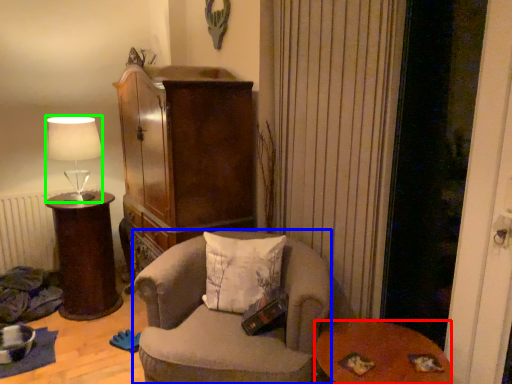
Question: Which is farther away from table (highlighted by a red box)? chair (highlighted by a blue box) or lamp (highlighted by a green box)?

Choices:
 (A) chair
 (B) lamp

Answer: (B)